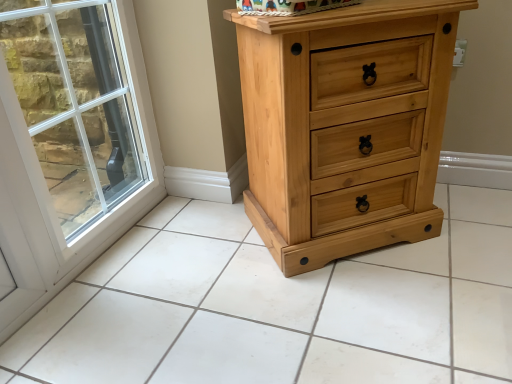
The width and height of the screenshot is (512, 384). Find the location of `vacant area situated to the left side of natural wood chest of drawers at right`. vacant area situated to the left side of natural wood chest of drawers at right is located at coordinates (202, 253).